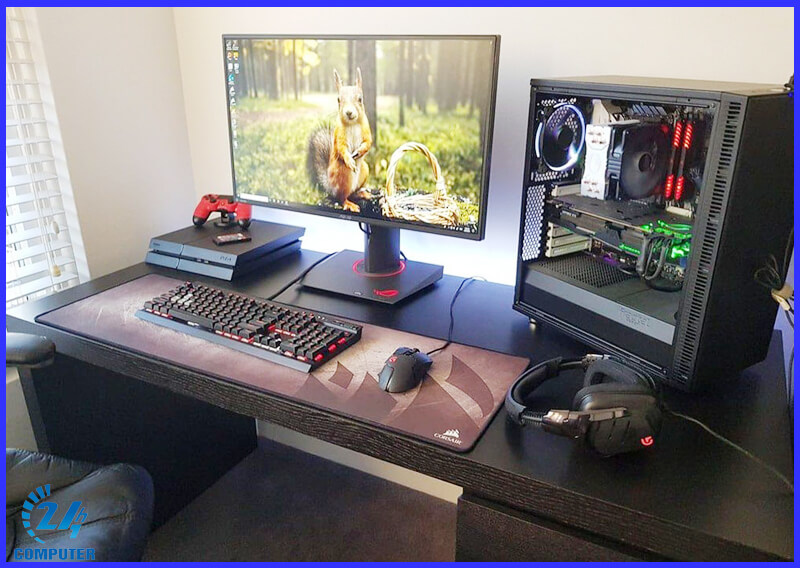
Where is `monitor stand`? The width and height of the screenshot is (800, 568). monitor stand is located at coordinates (376, 268).